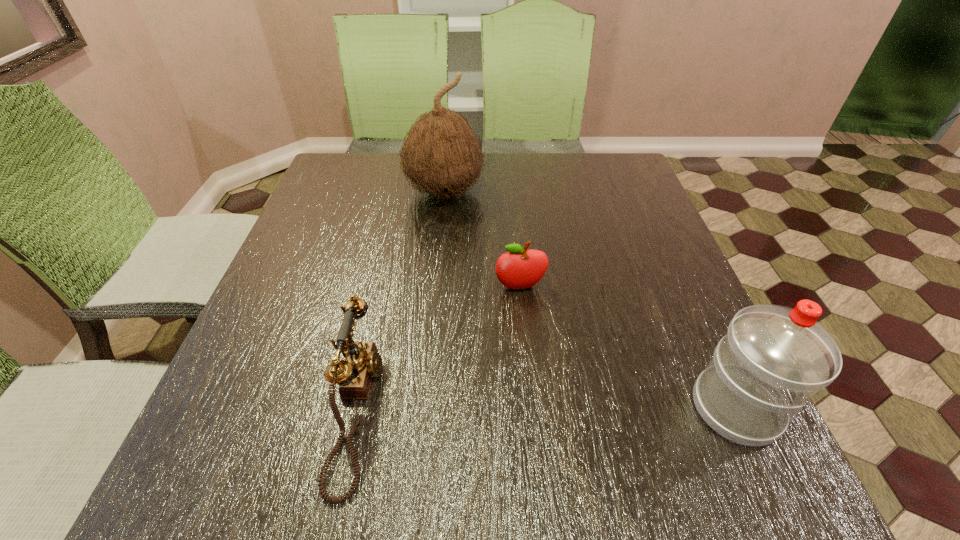
I want to click on free spot on the desktop that is between the telephone and the water bottle and is positioned on the front-facing side of the apple, so click(543, 408).

The height and width of the screenshot is (540, 960). Find the location of `free spot on the desktop that is between the telephone and the third shortest object and is positioned on the surface of the tallest object`. free spot on the desktop that is between the telephone and the third shortest object and is positioned on the surface of the tallest object is located at coordinates (516, 408).